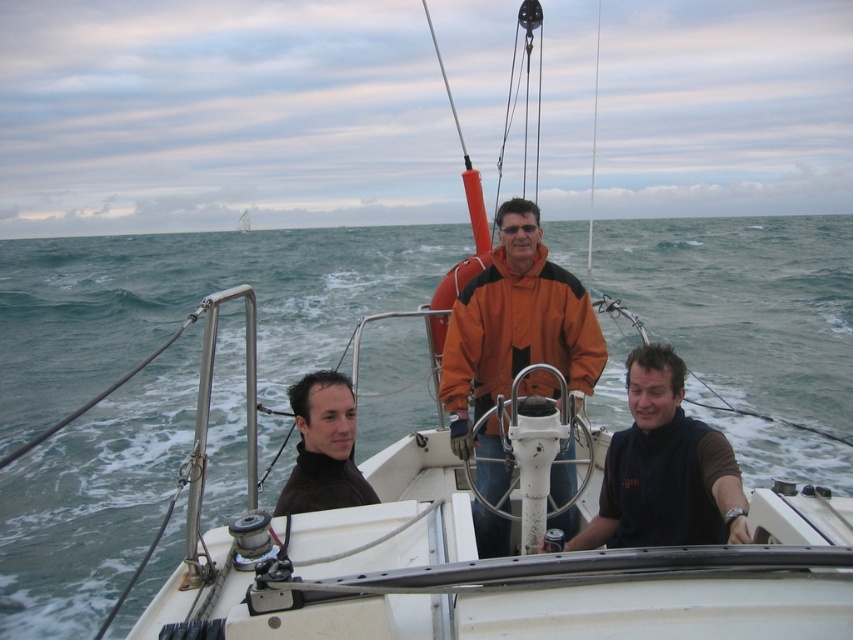
Question: Does orange matte jacket at center have a greater width compared to dark brown fabric shirt at center?

Choices:
 (A) yes
 (B) no

Answer: (A)

Question: Is green water at center positioned at the back of white fabric sail at upper center?

Choices:
 (A) yes
 (B) no

Answer: (B)

Question: Among these objects, which one is farthest from the camera?

Choices:
 (A) orange matte jacket at center
 (B) white fabric sail at upper center
 (C) dark brown fabric shirt at center
 (D) dark brown leather jacket at left

Answer: (B)

Question: Can you confirm if green water at center is wider than dark brown leather jacket at left?

Choices:
 (A) no
 (B) yes

Answer: (B)

Question: Which point is farther to the camera?

Choices:
 (A) (637, 442)
 (B) (242, 224)

Answer: (B)

Question: Which of these objects is positioned closest to the white fabric sail at upper center?

Choices:
 (A) orange matte jacket at center
 (B) dark brown fabric shirt at center
 (C) dark brown leather jacket at left
 (D) green water at center

Answer: (D)